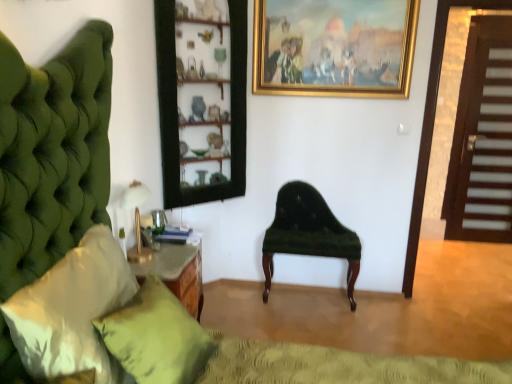
Describe the element at coordinates (72, 310) in the screenshot. Image resolution: width=512 pixels, height=384 pixels. I see `white satin pillow at left, positioned as the 2th pillow in back-to-front order` at that location.

The height and width of the screenshot is (384, 512). I want to click on gold metallic table lamp at left, so 136,219.

The image size is (512, 384). What do you see at coordinates (482, 138) in the screenshot?
I see `brown wooden door at right` at bounding box center [482, 138].

The height and width of the screenshot is (384, 512). What do you see at coordinates (308, 233) in the screenshot? I see `velvet green bench at center` at bounding box center [308, 233].

Where is `white satin pillow at left, positioned as the 2th pillow in back-to-front order`? The height and width of the screenshot is (384, 512). white satin pillow at left, positioned as the 2th pillow in back-to-front order is located at coordinates (72, 310).

Is white satin pillow at left, positioned as the 2th pillow in back-to-front order, directly adjacent to gold-framed painting at upper center?

No, white satin pillow at left, positioned as the 2th pillow in back-to-front order, is not touching gold-framed painting at upper center.

From the picture: Measure the distance from white satin pillow at left, positioned as the 2th pillow in back-to-front order, to gold-framed painting at upper center.

The distance of white satin pillow at left, positioned as the 2th pillow in back-to-front order, from gold-framed painting at upper center is 1.95 meters.

From the image's perspective, is white satin pillow at left, arranged as the first pillow when viewed from the front, over gold-framed painting at upper center?

Incorrect, from the image's perspective, white satin pillow at left, arranged as the first pillow when viewed from the front, is lower than gold-framed painting at upper center.

From their relative heights in the image, would you say white satin pillow at left, positioned as the 2th pillow in back-to-front order, is taller or shorter than gold-framed painting at upper center?

In the image, white satin pillow at left, positioned as the 2th pillow in back-to-front order, appears to be taller than gold-framed painting at upper center.

Who is smaller, brown wooden door at right or wooden shelves at center?

With smaller size is brown wooden door at right.

In the scene shown: Who is taller, brown wooden door at right or wooden shelves at center?

brown wooden door at right is taller.

Identify the location of shelf above the brown wooden door at right (from the image's perspective). The image size is (512, 384). (202, 99).

Is brown wooden door at right outside of wooden shelves at center?

Yes, brown wooden door at right is outside of wooden shelves at center.

Does velvet green bench at center touch gold metallic table lamp at left?

No, velvet green bench at center is not beside gold metallic table lamp at left.

At what (x,y) coordinates should I click in order to perform the action: click on chair beneath the gold metallic table lamp at left (from a real-world perspective). Please return your answer as a coordinate pair (x, y). Looking at the image, I should click on (308, 233).

How distant is velvet green bench at center from gold metallic table lamp at left?

1.23 meters.

Considering the relative sizes of velvet green bench at center and gold metallic table lamp at left in the image provided, is velvet green bench at center thinner than gold metallic table lamp at left?

Incorrect, the width of velvet green bench at center is not less than that of gold metallic table lamp at left.

Is wooden shelves at center looking in the opposite direction of velvet green bench at center?

No, wooden shelves at center is not facing the opposite direction of velvet green bench at center.

From a real-world perspective, is wooden shelves at center on velvet green bench at center?

Yes, from a real-world perspective, wooden shelves at center is over velvet green bench at center

Does wooden shelves at center lie in front of velvet green bench at center?

Yes, wooden shelves at center is closer to the camera.

Are wooden shelves at center and velvet green bench at center beside each other?

No, wooden shelves at center is not making contact with velvet green bench at center.

Based on the photo, considering the sizes of white satin pillow at left, positioned as the 2th pillow in back-to-front order, and wooden shelves at center in the image, is white satin pillow at left, positioned as the 2th pillow in back-to-front order, taller or shorter than wooden shelves at center?

Clearly, white satin pillow at left, positioned as the 2th pillow in back-to-front order, is shorter compared to wooden shelves at center.

Is wooden shelves at center at the back of white satin pillow at left, arranged as the first pillow when viewed from the front?

white satin pillow at left, arranged as the first pillow when viewed from the front, does not have its back to wooden shelves at center.

Can we say white satin pillow at left, positioned as the 2th pillow in back-to-front order, lies outside wooden shelves at center?

Indeed, white satin pillow at left, positioned as the 2th pillow in back-to-front order, is completely outside wooden shelves at center.

Considering the relative positions of white satin pillow at left, arranged as the first pillow when viewed from the front, and wooden shelves at center in the image provided, is white satin pillow at left, arranged as the first pillow when viewed from the front, to the left or to the right of wooden shelves at center?

Clearly, white satin pillow at left, arranged as the first pillow when viewed from the front, is on the left of wooden shelves at center in the image.

Is the position of gold-framed painting at upper center more distant than that of white satin pillow at left, positioned as the 2th pillow in back-to-front order?

Yes, it is.

Could you tell me if gold-framed painting at upper center is turned towards white satin pillow at left, arranged as the first pillow when viewed from the front?

No, gold-framed painting at upper center does not turn towards white satin pillow at left, arranged as the first pillow when viewed from the front.

From a real-world perspective, is gold-framed painting at upper center above or below white satin pillow at left, positioned as the 2th pillow in back-to-front order?

In terms of real-world spatial position, gold-framed painting at upper center is above white satin pillow at left, positioned as the 2th pillow in back-to-front order.

Considering the positions of objects gold-framed painting at upper center and white satin pillow at left, positioned as the 2th pillow in back-to-front order, in the image provided, who is more to the left, gold-framed painting at upper center or white satin pillow at left, positioned as the 2th pillow in back-to-front order,?

white satin pillow at left, positioned as the 2th pillow in back-to-front order.

Between brown wooden door at right and green fabric pillow at lower left, placed as the second pillow when sorted from front to back, which one is positioned in front?

green fabric pillow at lower left, placed as the second pillow when sorted from front to back, is closer to the camera.

Would you consider brown wooden door at right to be distant from green fabric pillow at lower left, placed as the second pillow when sorted from front to back?

Yes, brown wooden door at right and green fabric pillow at lower left, placed as the second pillow when sorted from front to back, are located far from each other.

Is point (489, 154) closer to camera compared to point (138, 353)?

No, (489, 154) is behind (138, 353).

Is brown wooden door at right wider or thinner than green fabric pillow at lower left, positioned as the first pillow in back-to-front order?

Clearly, brown wooden door at right has less width compared to green fabric pillow at lower left, positioned as the first pillow in back-to-front order.

Locate an element on the screen. picture frame that is above the white satin pillow at left, positioned as the 2th pillow in back-to-front order (from a real-world perspective) is located at coordinates click(x=334, y=47).

Where is `shelf that is above the brown wooden door at right (from the image's perspective)`? The image size is (512, 384). shelf that is above the brown wooden door at right (from the image's perspective) is located at coordinates (202, 99).

In the scene shown: Considering their positions, is velvet green bench at center positioned further to white satin pillow at left, arranged as the first pillow when viewed from the front, than wooden shelves at center?

velvet green bench at center is positioned further to the anchor white satin pillow at left, arranged as the first pillow when viewed from the front.

Which object lies nearer to the anchor point gold metallic table lamp at left, velvet green bench at center or green fabric pillow at lower left, positioned as the first pillow in back-to-front order?

The object closer to gold metallic table lamp at left is green fabric pillow at lower left, positioned as the first pillow in back-to-front order.

Considering their positions, is white satin pillow at left, arranged as the first pillow when viewed from the front, positioned further to gold-framed painting at upper center than wooden shelves at center?

white satin pillow at left, arranged as the first pillow when viewed from the front, lies further to gold-framed painting at upper center than the other object.

Looking at the image, which one is located closer to gold-framed painting at upper center, green fabric pillow at lower left, placed as the second pillow when sorted from front to back, or wooden shelves at center?

Among the two, wooden shelves at center is located nearer to gold-framed painting at upper center.

Based on their spatial positions, is wooden shelves at center or velvet green bench at center closer to gold metallic table lamp at left?

→ wooden shelves at center is positioned closer to the anchor gold metallic table lamp at left.

Based on the photo, based on their spatial positions, is wooden shelves at center or gold metallic table lamp at left closer to brown wooden door at right?

wooden shelves at center is positioned closer to the anchor brown wooden door at right.

When comparing their distances from wooden shelves at center, does gold metallic table lamp at left or velvet green bench at center seem further?

The object further to wooden shelves at center is gold metallic table lamp at left.

Considering their positions, is green fabric pillow at lower left, placed as the second pillow when sorted from front to back, positioned closer to wooden shelves at center than gold-framed painting at upper center?

Based on the image, gold-framed painting at upper center appears to be nearer to wooden shelves at center.

Locate an element on the screen. table lamp between gold-framed painting at upper center and green fabric pillow at lower left, placed as the second pillow when sorted from front to back, in the vertical direction is located at coordinates click(x=136, y=219).

Where is `pillow that lies between gold-framed painting at upper center and green fabric pillow at lower left, positioned as the first pillow in back-to-front order, from top to bottom`? This screenshot has width=512, height=384. pillow that lies between gold-framed painting at upper center and green fabric pillow at lower left, positioned as the first pillow in back-to-front order, from top to bottom is located at coordinates (72, 310).

In order to click on picture frame located between white satin pillow at left, positioned as the 2th pillow in back-to-front order, and velvet green bench at center in the depth direction in this screenshot , I will do `click(334, 47)`.

The width and height of the screenshot is (512, 384). I want to click on table lamp located between white satin pillow at left, positioned as the 2th pillow in back-to-front order, and velvet green bench at center in the depth direction, so click(136, 219).